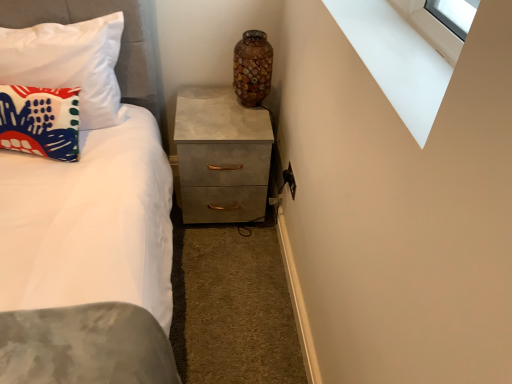
Locate an element on the screen. This screenshot has width=512, height=384. vacant space to the left of mosaic glass vase at upper center is located at coordinates (206, 100).